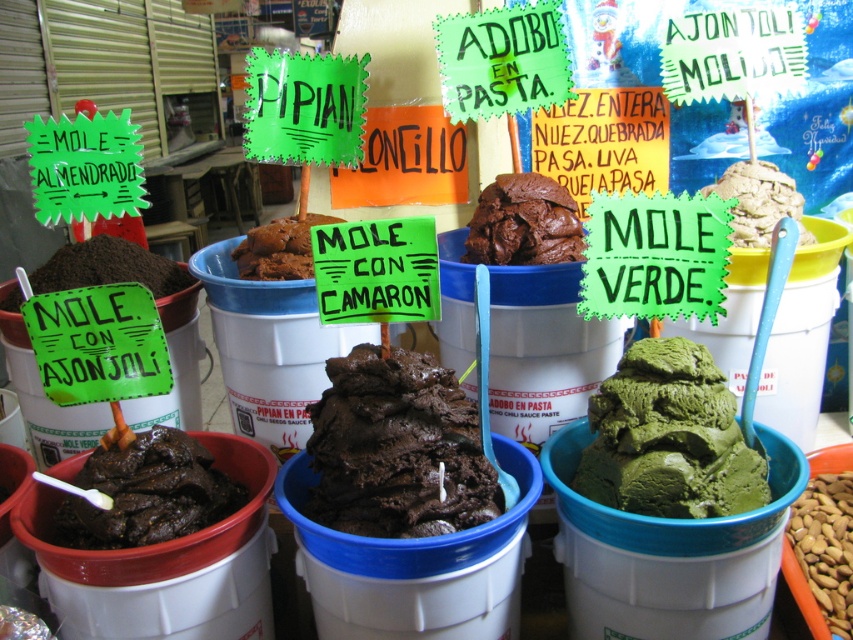
Question: Is dark brown creamy ice cream at center closer to camera compared to dark brown paste at lower left?

Choices:
 (A) no
 (B) yes

Answer: (B)

Question: Which of these objects is positioned closest to the chocolate paste at center?

Choices:
 (A) green smooth paste at center
 (B) brown powder at left
 (C) green matte ice cream at center

Answer: (C)

Question: Where is chocolate paste at center located in relation to green matte mole verde at upper right in the image?

Choices:
 (A) right
 (B) left

Answer: (B)

Question: Which point is farther from the camera taking this photo?

Choices:
 (A) (750, 228)
 (B) (120, 497)

Answer: (A)

Question: Is chocolate paste at center to the left of green smooth paste at center from the viewer's perspective?

Choices:
 (A) no
 (B) yes

Answer: (B)

Question: Among these objects, which one is farthest from the camera?

Choices:
 (A) dark brown paste at lower left
 (B) dark brown creamy ice cream at center
 (C) brown matte mole at center

Answer: (C)